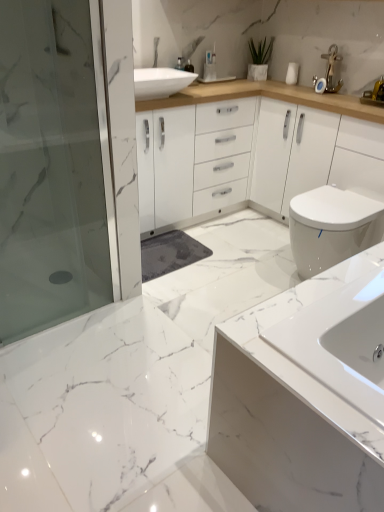
Find the location of a particular element. free spot above white glossy toilet at right (from a real-world perspective) is located at coordinates (340, 204).